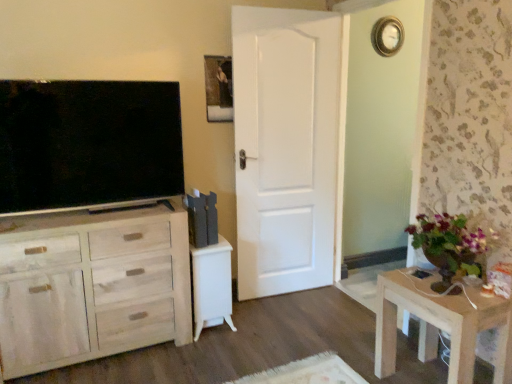
Locate an element on the screen. The image size is (512, 384). vacant area situated below matte black tv at left (from a real-world perspective) is located at coordinates (109, 212).